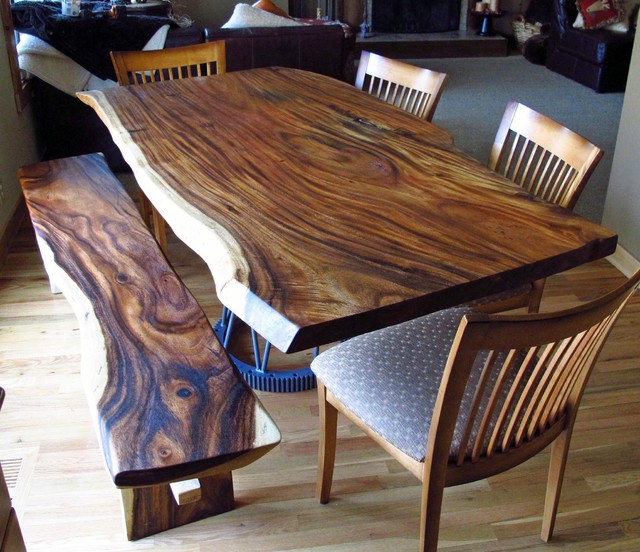
The height and width of the screenshot is (552, 640). Find the location of `dining chairs`. dining chairs is located at coordinates (179, 58), (406, 78), (560, 132), (564, 317).